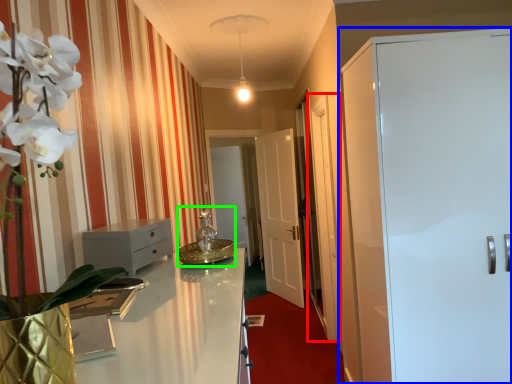
Question: Which object is positioned farthest from glass door (highlighted by a red box)? Select from door (highlighted by a blue box) and sink (highlighted by a green box).

Choices:
 (A) door
 (B) sink

Answer: (B)